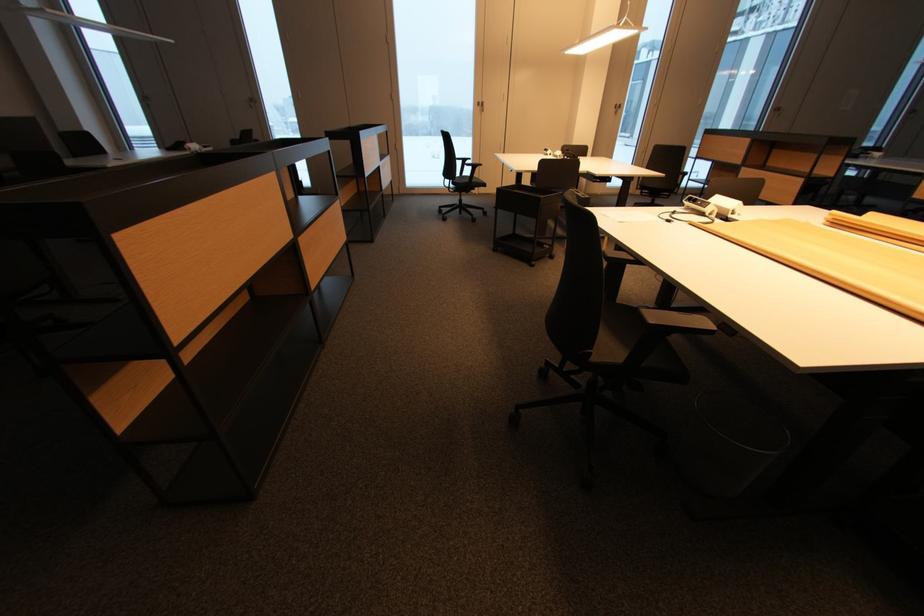
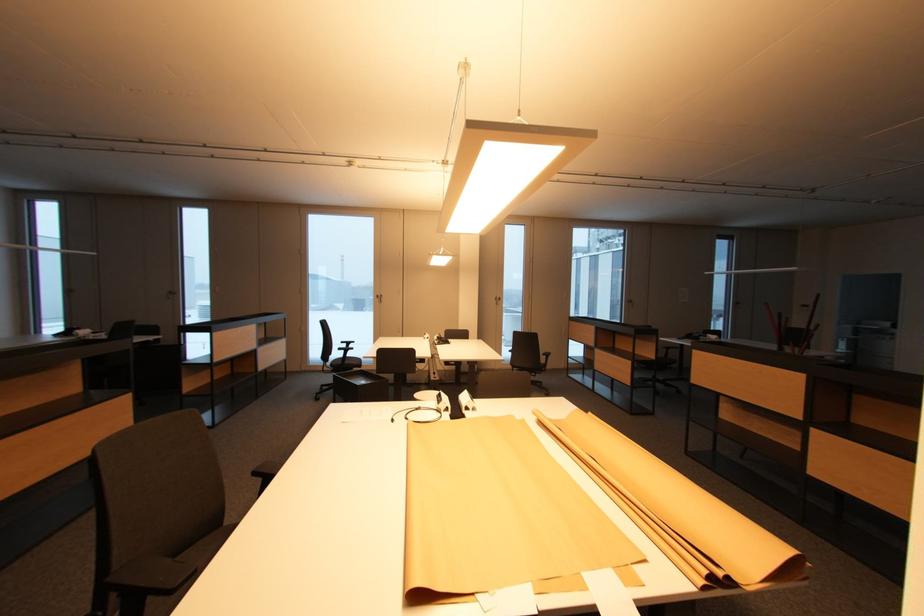
Question: The images are taken continuously from a first-person perspective. In which direction are you moving?

Choices:
 (A) Left
 (B) Right
 (C) Forward
 (D) Backward

Answer: (B)